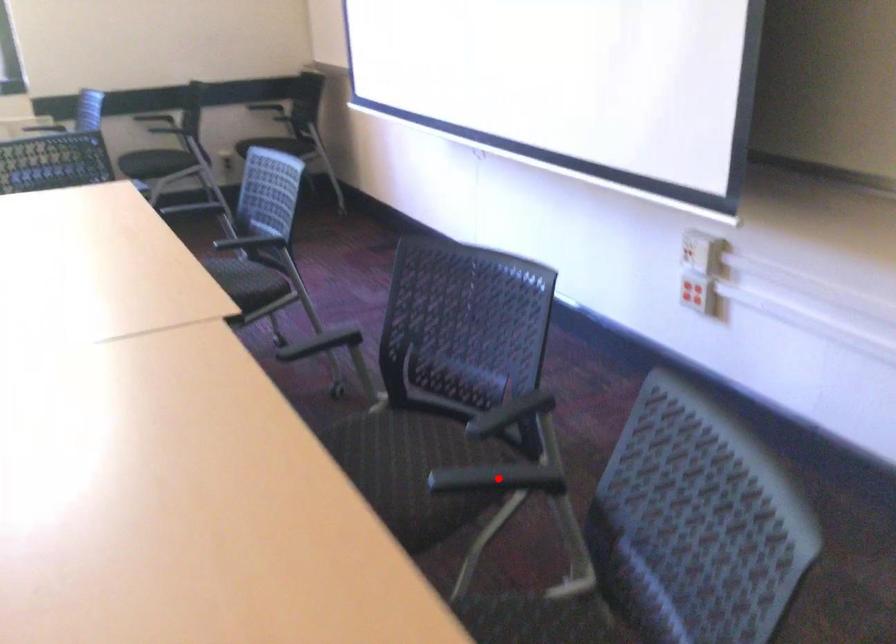
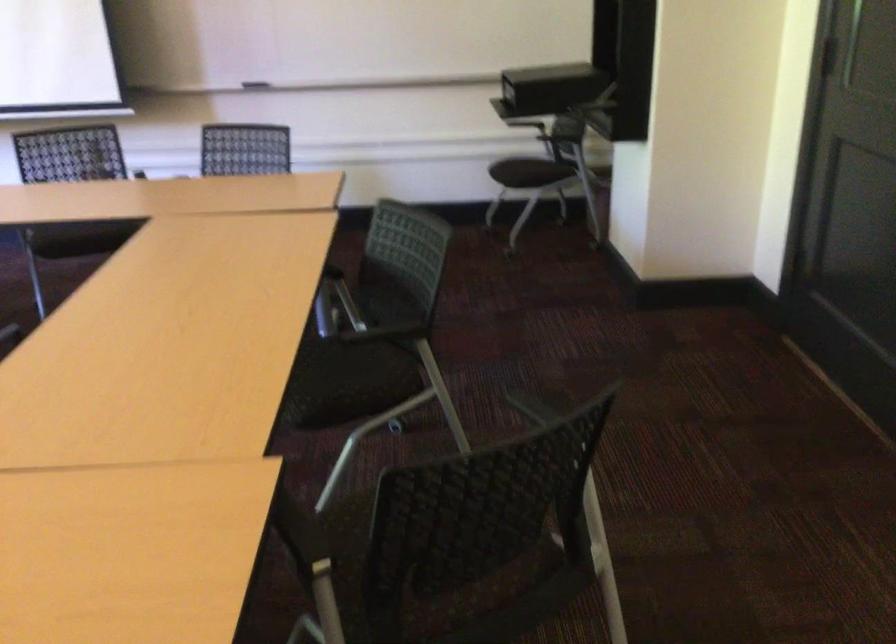
Question: I am providing you with two images of the same scene from different viewpoints. A red point is marked on the first image. Is the red point's position out of view in image 2?

Choices:
 (A) Yes
 (B) No

Answer: (A)